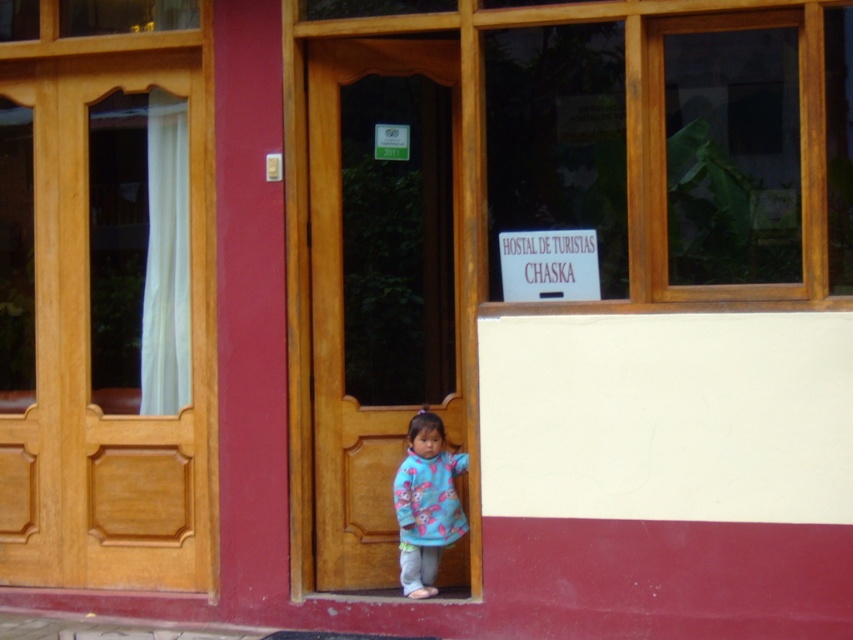
Question: Which of the following is the closest to the observer?

Choices:
 (A) (119, 131)
 (B) (444, 284)
 (C) (412, 480)

Answer: (C)

Question: Which point is farther from the camera taking this photo?

Choices:
 (A) (408, 532)
 (B) (367, 285)

Answer: (B)

Question: Is the position of wooden door at center less distant than that of fluffy fleece sweater at center?

Choices:
 (A) no
 (B) yes

Answer: (A)

Question: Among these objects, which one is farthest from the camera?

Choices:
 (A) wooden door at center
 (B) wooden door at left
 (C) fluffy fleece sweater at center

Answer: (B)

Question: Does wooden door at left appear under fluffy fleece sweater at center?

Choices:
 (A) no
 (B) yes

Answer: (A)

Question: Is wooden door at left wider than wooden door at center?

Choices:
 (A) no
 (B) yes

Answer: (B)